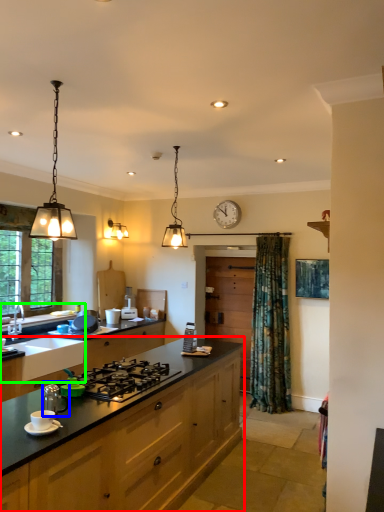
Question: Estimate the real-world distances between objects in this image. Which object is farther from cabinetry (highlighted by a red box), tea pot (highlighted by a blue box) or sink (highlighted by a green box)?

Choices:
 (A) tea pot
 (B) sink

Answer: (B)